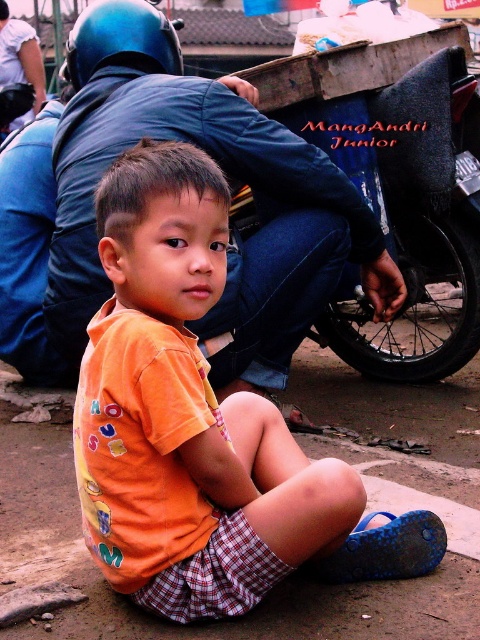
Question: Among these objects, which one is nearest to the camera?

Choices:
 (A) blue denim jacket at upper center
 (B) brown dirt pavement at center
 (C) blue matte helmet at upper left

Answer: (B)

Question: Which point is closer to the camera?

Choices:
 (A) (356, 512)
 (B) (91, 72)
 (C) (39, 51)

Answer: (A)

Question: Is orange cotton shirt at center bigger than blue matte helmet at upper left?

Choices:
 (A) yes
 (B) no

Answer: (A)

Question: Which point is farther to the camera?

Choices:
 (A) (468, 556)
 (B) (15, 60)
 (C) (123, 184)

Answer: (B)

Question: Can you confirm if blue denim jacket at upper center is smaller than brown dirt pavement at center?

Choices:
 (A) yes
 (B) no

Answer: (A)

Question: Is orange cotton shirt at center to the right of blue matte helmet at upper left from the viewer's perspective?

Choices:
 (A) no
 (B) yes

Answer: (B)